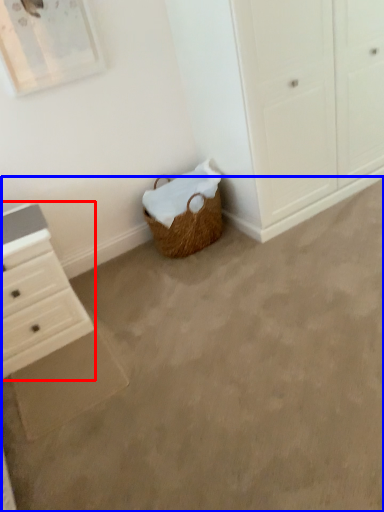
Question: Which object is further to the camera taking this photo, chest of drawers (highlighted by a red box) or concrete (highlighted by a blue box)?

Choices:
 (A) chest of drawers
 (B) concrete

Answer: (A)